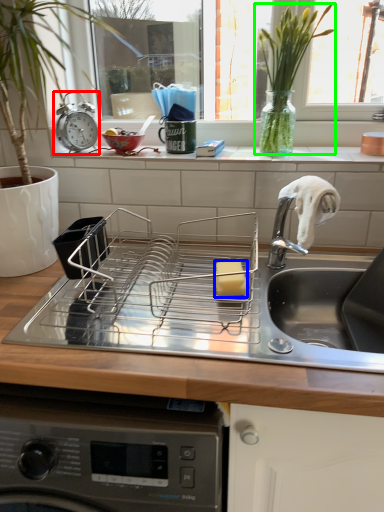
Question: Estimate the real-world distances between objects in this image. Which object is closer to alarm clock (highlighted by a red box), food (highlighted by a blue box) or plant (highlighted by a green box)?

Choices:
 (A) food
 (B) plant

Answer: (B)